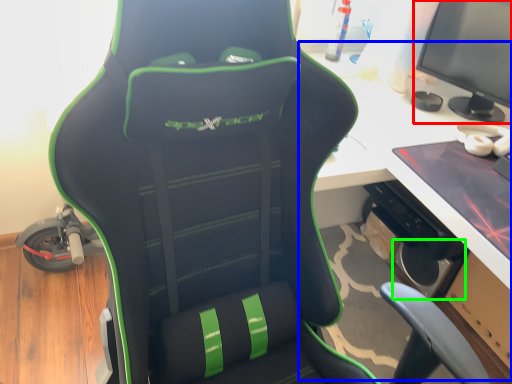
Question: Which is nearer to the computer monitor (highlighted by a red box)? computer desk (highlighted by a blue box) or speaker (highlighted by a green box).

Choices:
 (A) computer desk
 (B) speaker

Answer: (A)